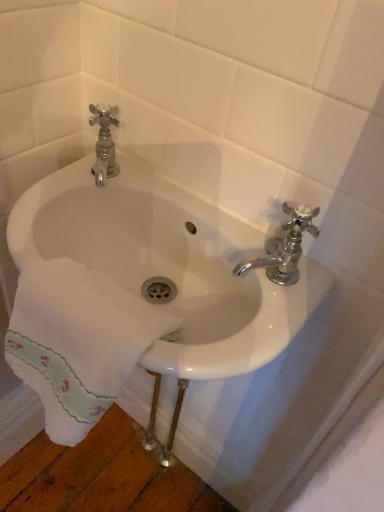
In order to click on vacant area situated to the left side of chrome metallic faucet at upper right in this screenshot , I will do `click(189, 220)`.